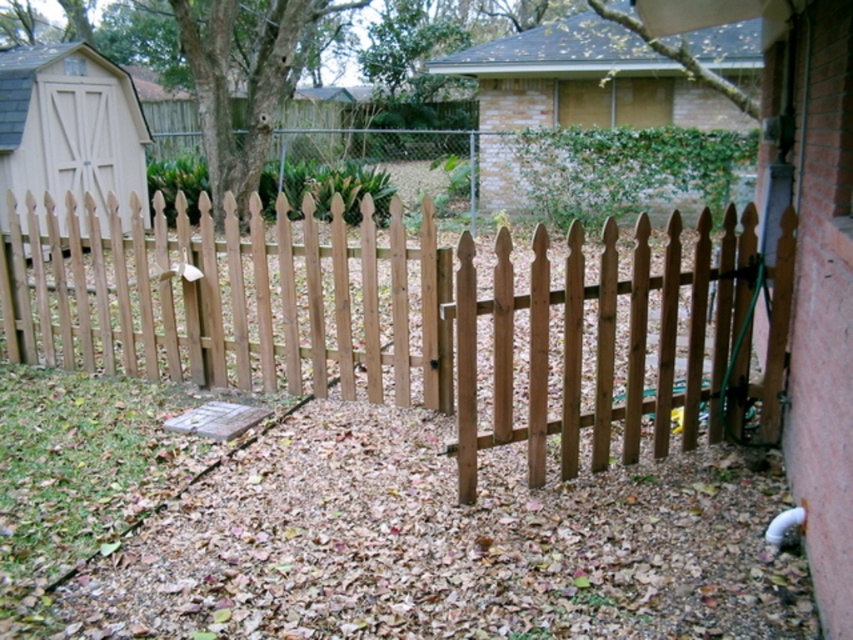
Question: Which point is closer to the camera taking this photo?

Choices:
 (A) (16, 172)
 (B) (640, 394)

Answer: (B)

Question: Which of the following is the closest to the observer?

Choices:
 (A) (730, 353)
 (B) (74, 164)

Answer: (A)

Question: Can you confirm if light brown wood picket fence at center is smaller than light brown wood shed at left?

Choices:
 (A) no
 (B) yes

Answer: (A)

Question: Which point is farther to the camera?

Choices:
 (A) (35, 77)
 (B) (292, 268)

Answer: (A)

Question: Can you confirm if light brown wood picket fence at center is positioned to the left of light brown wood shed at left?

Choices:
 (A) yes
 (B) no

Answer: (B)

Question: Is light brown wood picket fence at center smaller than light brown wood shed at left?

Choices:
 (A) yes
 (B) no

Answer: (B)